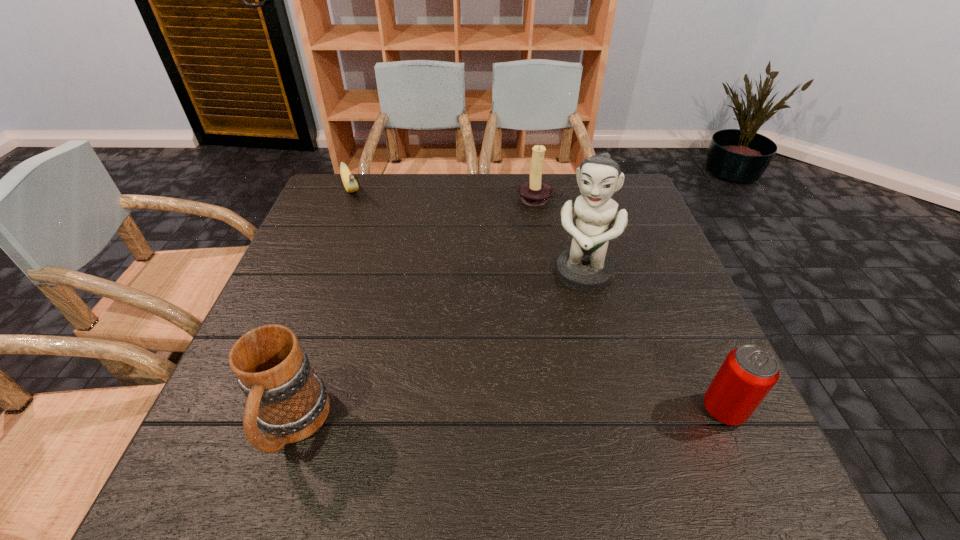
The height and width of the screenshot is (540, 960). Find the location of `free spot located 0.170m on the wick of the candle holder`. free spot located 0.170m on the wick of the candle holder is located at coordinates (524, 244).

The height and width of the screenshot is (540, 960). I want to click on free region located on the front-facing side of the tallest object, so click(x=563, y=329).

Identify the location of free space located on the front-facing side of the tallest object. (551, 361).

Where is `vacant area situated on the front-facing side of the tallest object`? vacant area situated on the front-facing side of the tallest object is located at coordinates (549, 364).

I want to click on vacant point located 0.100m at the stem of the banana, so click(x=359, y=223).

Find the location of a particular element. This screenshot has width=960, height=540. vacant space located at the stem of the banana is located at coordinates (365, 235).

This screenshot has width=960, height=540. Identify the location of vacant area situated 0.400m at the stem of the banana. (389, 292).

In order to click on candle holder that is at the far edge in this screenshot , I will do tap(534, 192).

In order to click on banana that is at the far edge in this screenshot , I will do `click(350, 184)`.

This screenshot has width=960, height=540. Find the location of `mug that is at the near edge`. mug that is at the near edge is located at coordinates (288, 402).